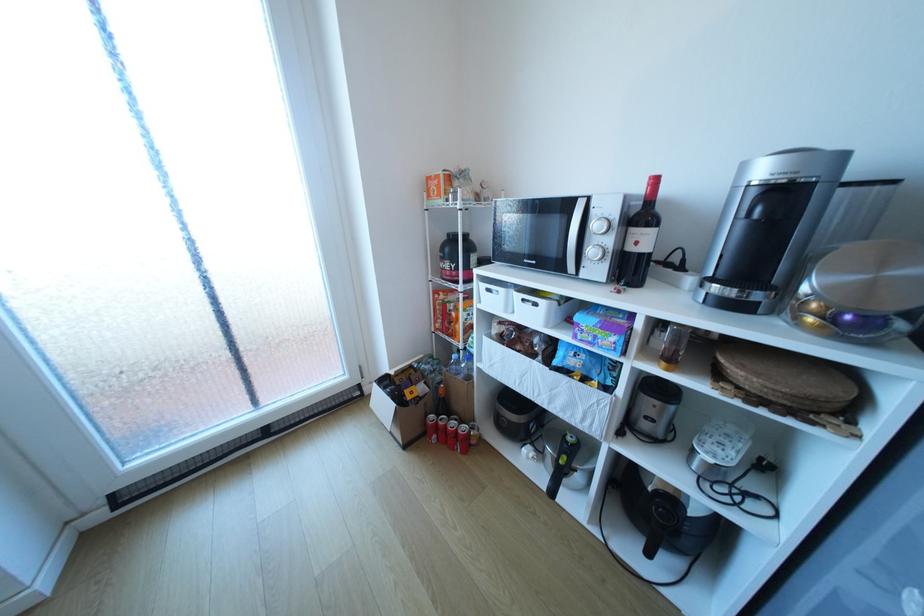
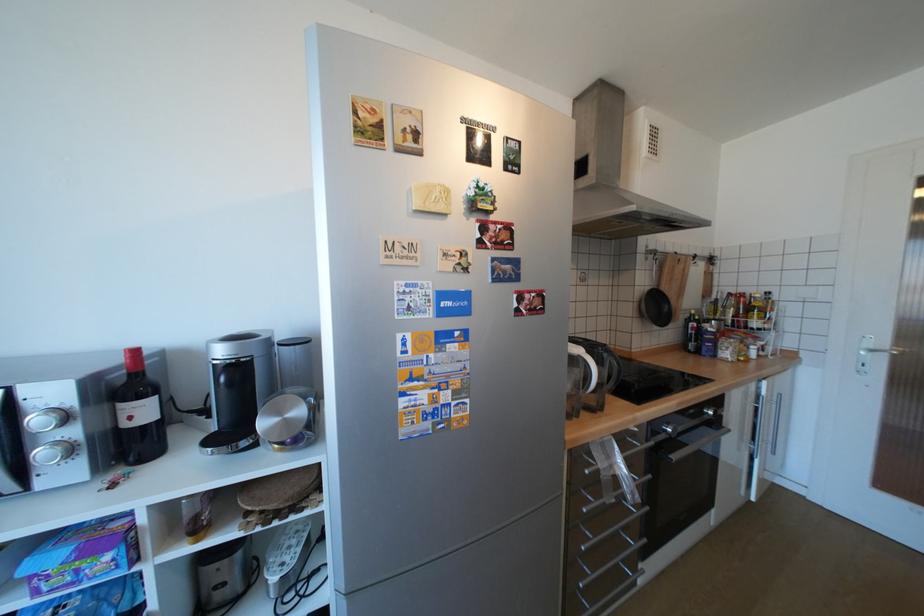
Find the pixel in the second image that matches the point at 600,339 in the first image.

(79, 578)